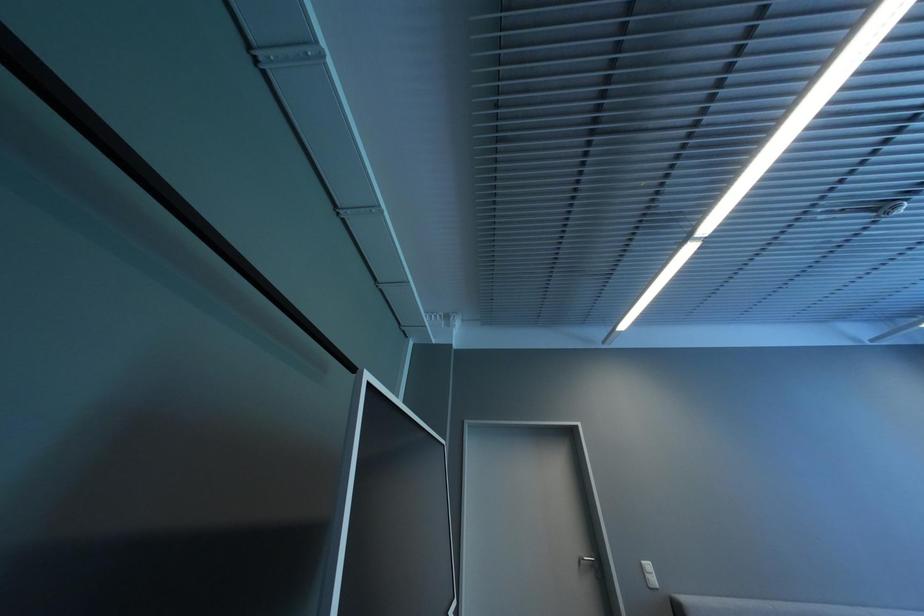
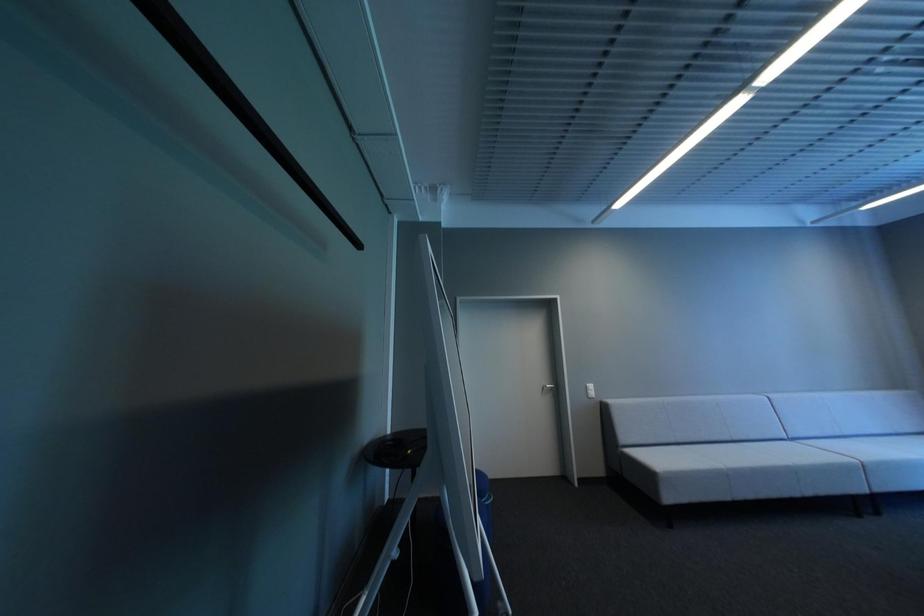
Question: Based on the continuous images, in which direction is the camera rotating? Reply with the corresponding letter.

Choices:
 (A) Left
 (B) Right
 (C) Up
 (D) Down

Answer: (D)